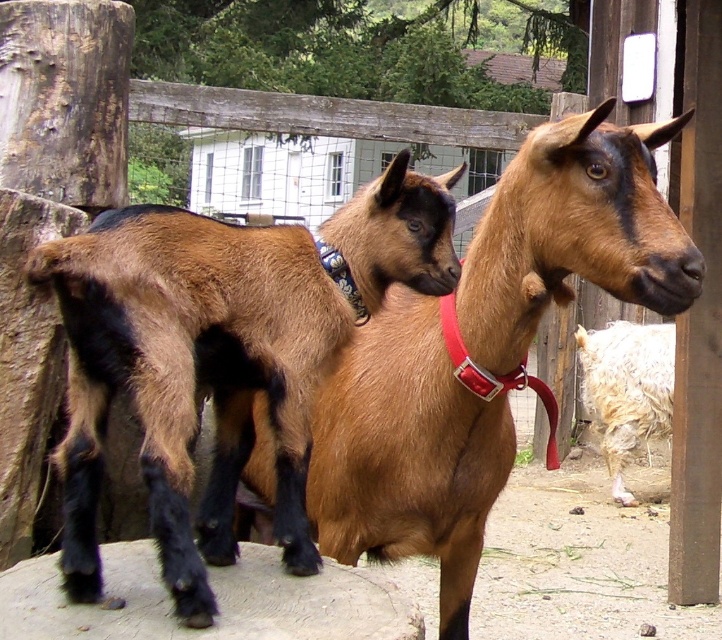
Question: Considering the real-world distances, which object is farthest from the brown woolen goat at center?

Choices:
 (A) blue fabric neckband at upper center
 (B) fluffy white goat at right
 (C) smooth gray rock at center
 (D) red nylon collar at center

Answer: (B)

Question: Which point appears farthest from the camera in this image?

Choices:
 (A) (360, 316)
 (B) (638, 356)

Answer: (B)

Question: Observing the image, what is the correct spatial positioning of brown woolen goat at center in reference to blue fabric neckband at upper center?

Choices:
 (A) above
 (B) below

Answer: (B)

Question: Is brown woolen goat at center thinner than smooth gray rock at center?

Choices:
 (A) no
 (B) yes

Answer: (A)

Question: Based on their relative distances, which object is farther from the fluffy white goat at right?

Choices:
 (A) smooth gray rock at center
 (B) brown fuzzy goat at center
 (C) blue fabric neckband at upper center

Answer: (A)

Question: Does brown woolen goat at center have a smaller size compared to smooth gray rock at center?

Choices:
 (A) no
 (B) yes

Answer: (A)